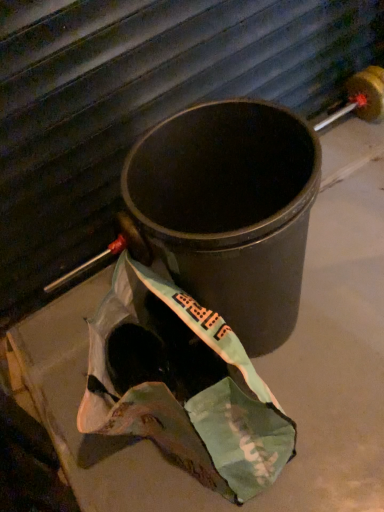
I want to click on unoccupied area in front of black matte trash can at center, so click(331, 408).